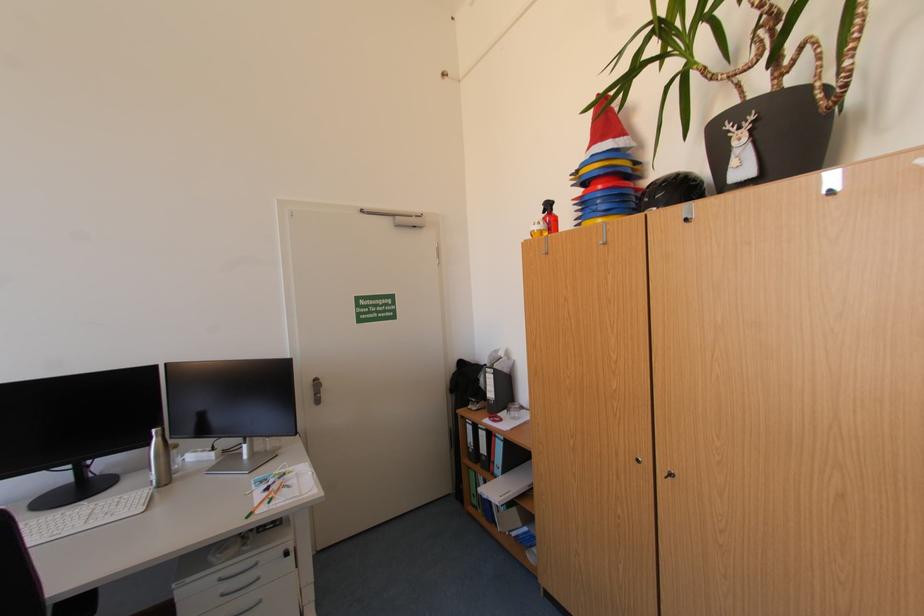
Where would you lift the blue ring binder? Please return your answer as a coordinate pair (x, y).

(606, 169)